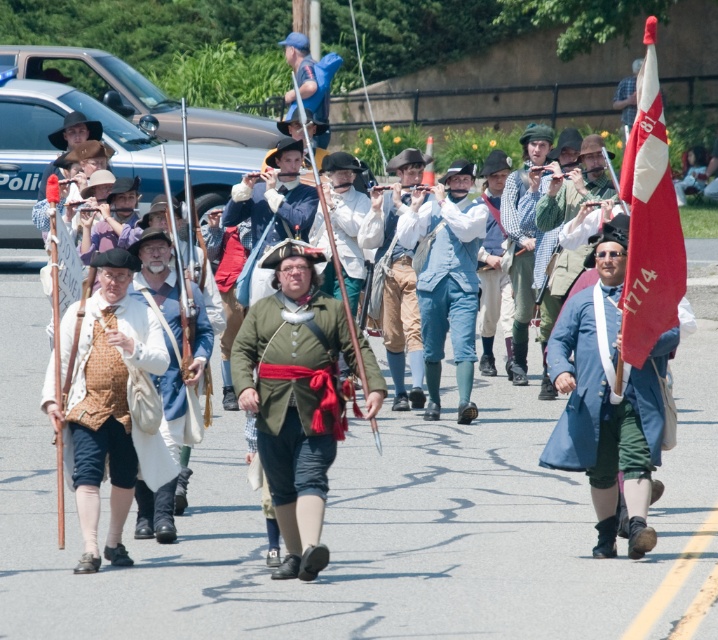
You are a costume designer preparing for a historical play. You have two items from the scene to place on a display table. The green fabric coat at center and the red fabric flag at right. Which item will require more horizontal space on the table?

The red fabric flag at right requires more horizontal space because it has a greater width than the green fabric coat at center.

Based on the photo, you are a historian analyzing the historical reenactment scene. You notice the green fabric coat at center and the red fabric flag at right. Based on their positions, which object is closer to the left side of the image?

The green fabric coat at center is closer to the left side of the image because it is positioned to the left of the red fabric flag at right.

You are observing a historical reenactment of an 18th century military parade. You notice a point at coordinates (108, 404). What object is located at that point?

The matte brown vest at center is located at point (108, 404).